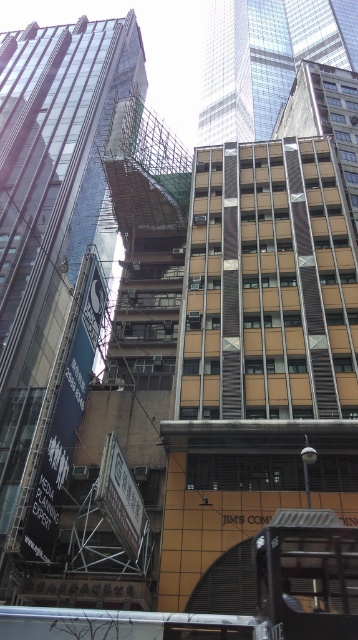
You are a drone operator tasked with flying a drone between the brown textured building at center and the glassy steel skyscraper at upper center. The drone has a maximum flight distance of 150 meters. Can the drone safely fly between these two structures without exceeding its range?

The brown textured building at center and the glassy steel skyscraper at upper center are 138.84 meters apart from each other. Since the drone has a maximum flight distance of 150 meters, it can safely fly between them without exceeding its range.

You are standing in the middle of the street looking at the brown textured building at center and the glassy steel skyscraper at upper center. Which building is nearer to you?

The brown textured building at center is closer to the viewer than the glassy steel skyscraper at upper center.

You are an urban planner assessing the potential for a new pedestrian walkway between the brown textured building at center and the glassy steel skyscraper at upper center. Based on the scene description, which of the two structures is narrower, and how might this affect the walkway design?

The brown textured building at center has a lesser width compared to the glassy steel skyscraper at upper center. This means the narrower building may allow for a more compact walkway design, while the wider skyscraper could require a broader pathway to accommodate foot traffic efficiently.